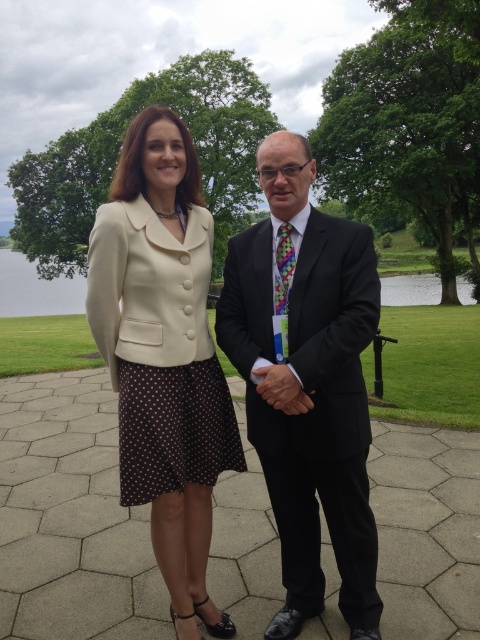
You are standing at the point marked as point (308,381) in the image. Looking around, you see the two people described. Which direction should you face to look at the matte black suit at center?

The matte black suit at center is located at point (308,381), so you are already facing it.

You are a photographer trying to capture a portrait of the two people in the scene. You want to ensure that the matte black suit at center and the smooth leather hand at center are both clearly visible in the frame. Based on their positions, which object should you focus on first to ensure both are in focus?

The smooth leather hand at center should be focused on first since it is closer to the photographer than the matte black suit at center, which is further away. By focusing on the closer object, both will be in focus due to the depth of field.

You are a photographer trying to capture a portrait of the two people in the scene. You notice the matte black suit at center and the smooth leather hand at center. Which object should you focus on if you want to highlight the subject wearing the formal attire?

The matte black suit at center should be focused on because it is part of the formal attire worn by the subject, and it is positioned above the smooth leather hand at center, making it more prominent in the composition.